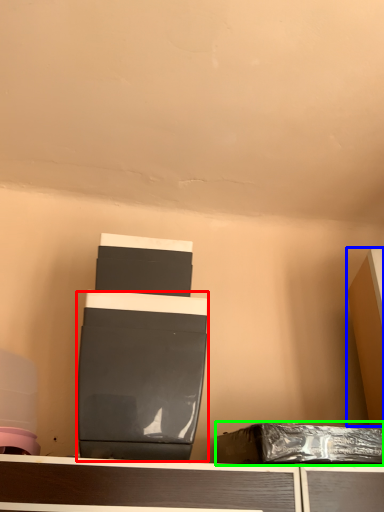
Question: Estimate the real-world distances between objects in this image. Which object is farther from wide (highlighted by a red box), furniture (highlighted by a blue box) or waste (highlighted by a green box)?

Choices:
 (A) furniture
 (B) waste

Answer: (A)